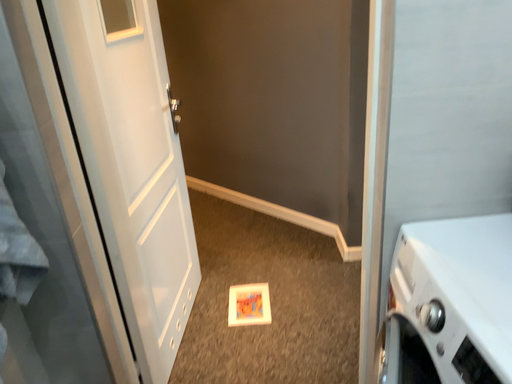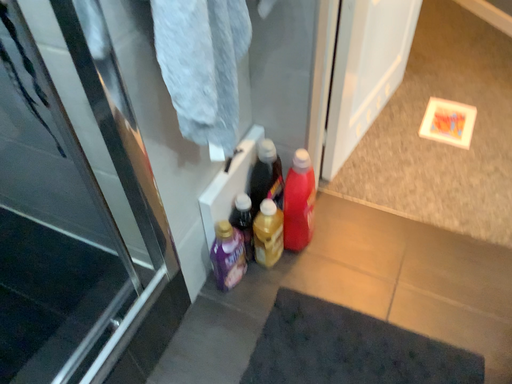
Question: Which way did the camera rotate in the video?

Choices:
 (A) rotated upward
 (B) rotated downward

Answer: (B)